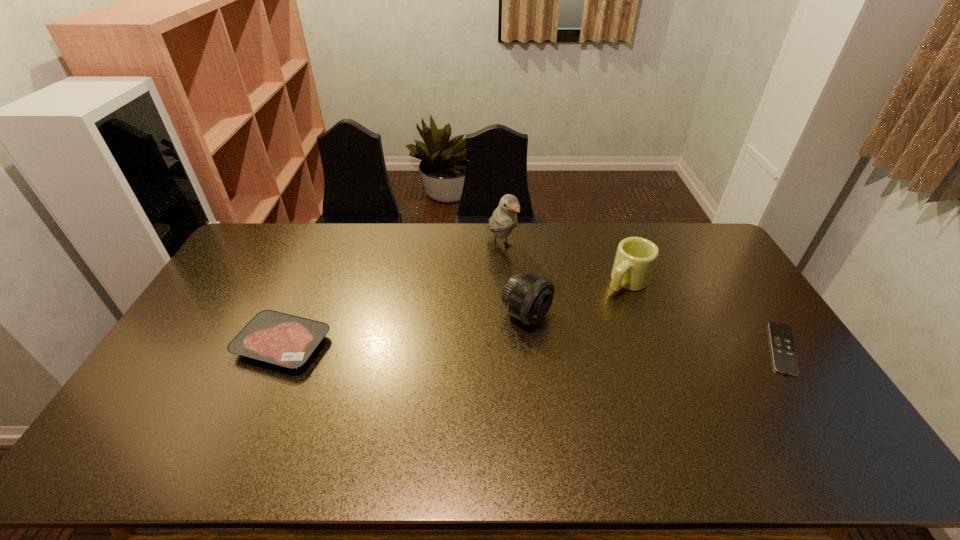
At what (x,y) coordinates should I click in order to perform the action: click on object present at the right edge. Please return your answer as a coordinate pair (x, y). This screenshot has width=960, height=540. Looking at the image, I should click on (784, 356).

Identify the location of blank space at the far edge. (393, 255).

Where is `vacant area at the near edge of the desktop`? This screenshot has width=960, height=540. vacant area at the near edge of the desktop is located at coordinates (564, 408).

Where is `vacant space at the left edge`? The image size is (960, 540). vacant space at the left edge is located at coordinates (184, 386).

Locate an element on the screen. This screenshot has width=960, height=540. free space at the right edge is located at coordinates (748, 320).

This screenshot has width=960, height=540. In order to click on free space at the far left corner of the desktop in this screenshot , I will do `click(276, 234)`.

The image size is (960, 540). I want to click on vacant space at the far right corner of the desktop, so click(711, 258).

This screenshot has width=960, height=540. What are the coordinates of `vacant area between the telephoto lens and the second object from right to left` in the screenshot? It's located at (577, 298).

This screenshot has width=960, height=540. I want to click on empty space between the remote control and the telephoto lens, so click(655, 332).

You are a GUI agent. You are given a task and a screenshot of the screen. Output one action in this format:
    pyautogui.click(x=<x>, y=<y>)
    Task: Click on the free space between the rightmost object and the mug
    
    Given the screenshot: What is the action you would take?
    pyautogui.click(x=705, y=315)